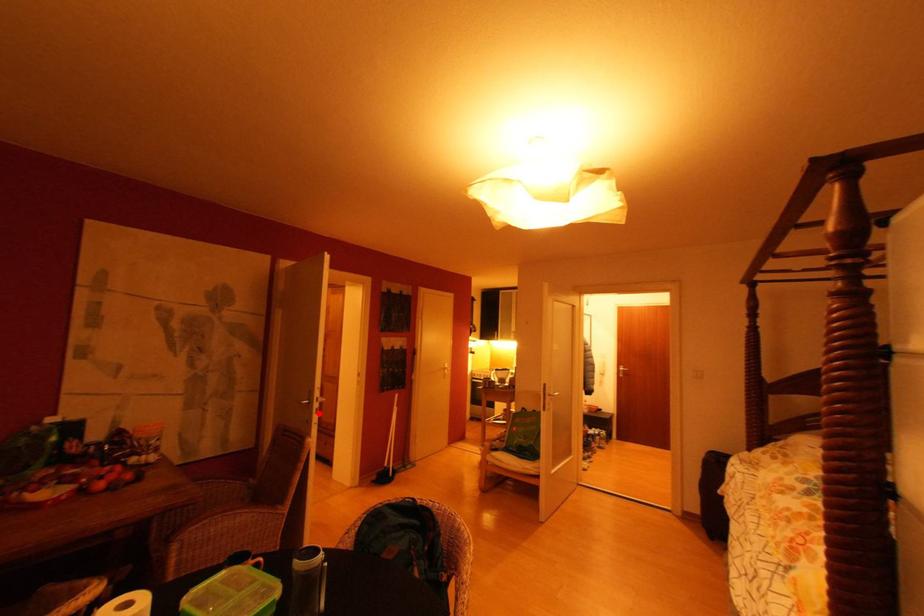
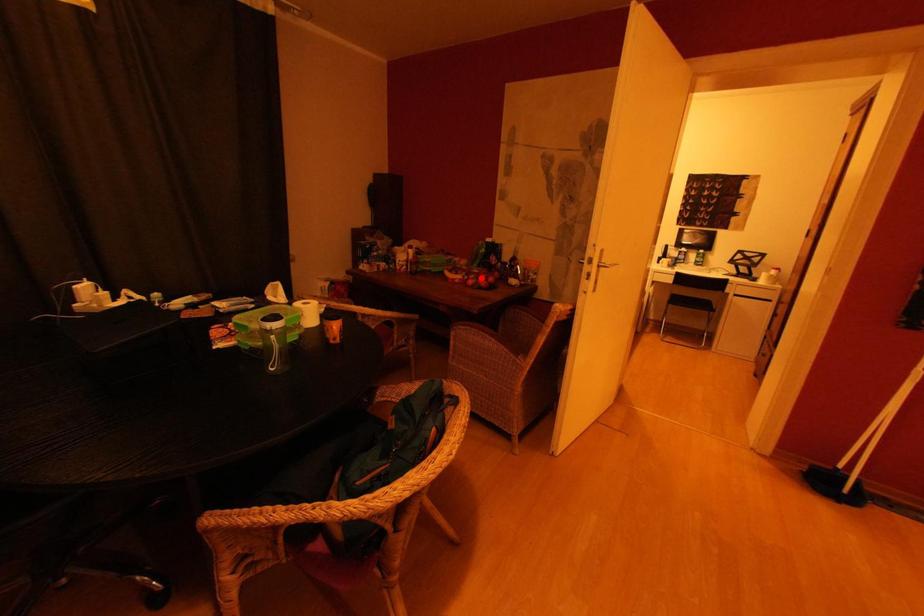
I am providing you with two images of the same scene from different viewpoints. A red point is marked on the first image and another point is marked on the second image. Is the red point in image1 aligned with the point shown in image2?

No